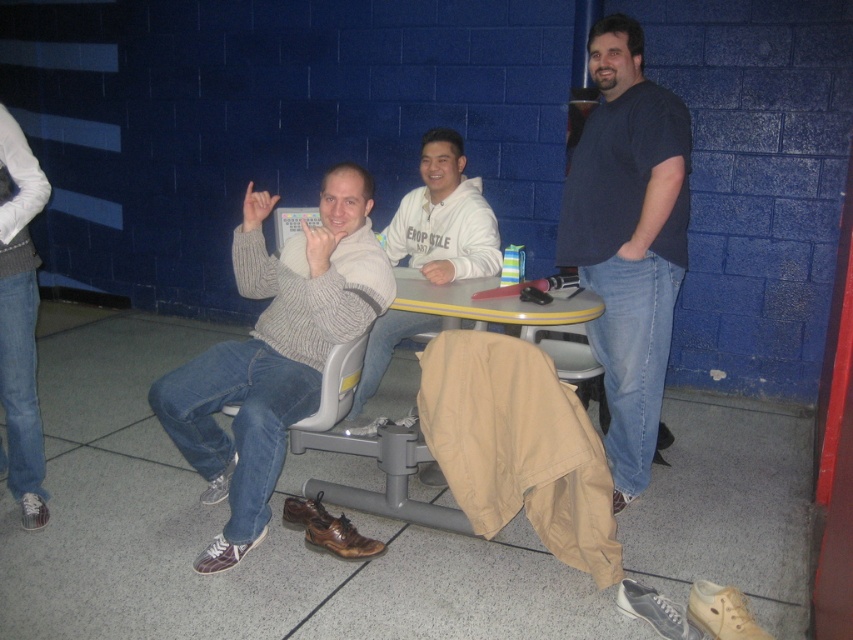
You are standing at the camera position and want to throw a small ball to the point marked as point (430, 212). What is the approximate distance you need to throw the ball?

The distance between the camera and point (430, 212) is 3.47 meters, so you need to throw the ball approximately 3.47 meters.